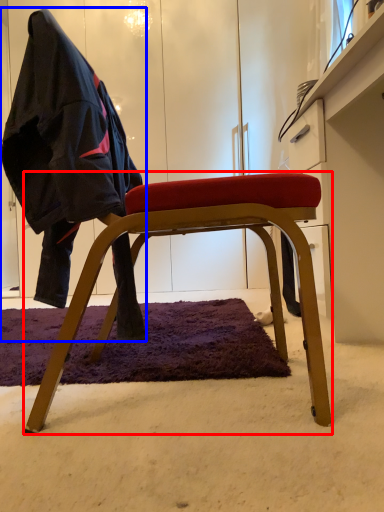
Question: Among these objects, which one is farthest to the camera, chair (highlighted by a red box) or person (highlighted by a blue box)?

Choices:
 (A) chair
 (B) person

Answer: (A)